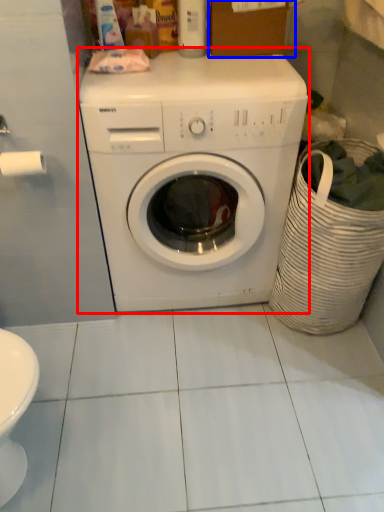
Question: Which point is further to the camera, washing machine (highlighted by a red box) or cardboard box (highlighted by a blue box)?

Choices:
 (A) washing machine
 (B) cardboard box

Answer: (B)